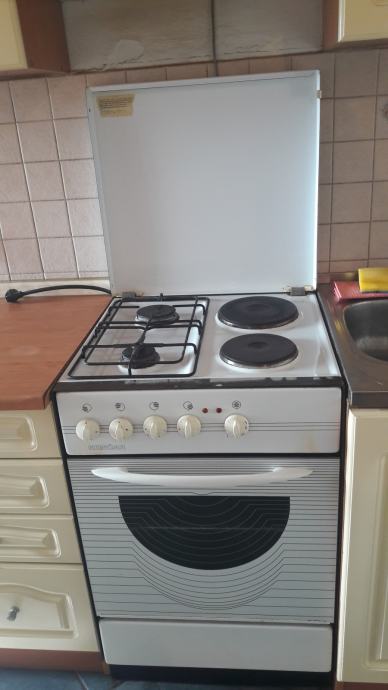
The width and height of the screenshot is (388, 690). I want to click on white under oven drawer, so [263, 656].